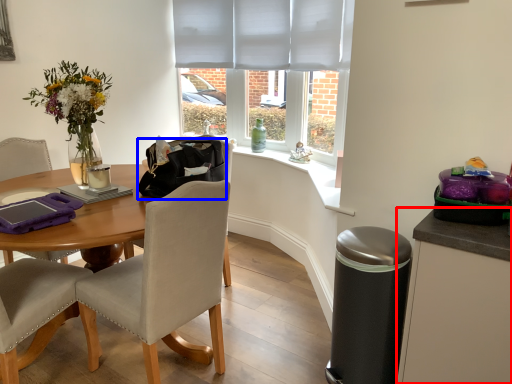
Question: Which of the following is the farthest to the observer, cabinetry (highlighted by a red box) or handbag (highlighted by a blue box)?

Choices:
 (A) cabinetry
 (B) handbag

Answer: (B)